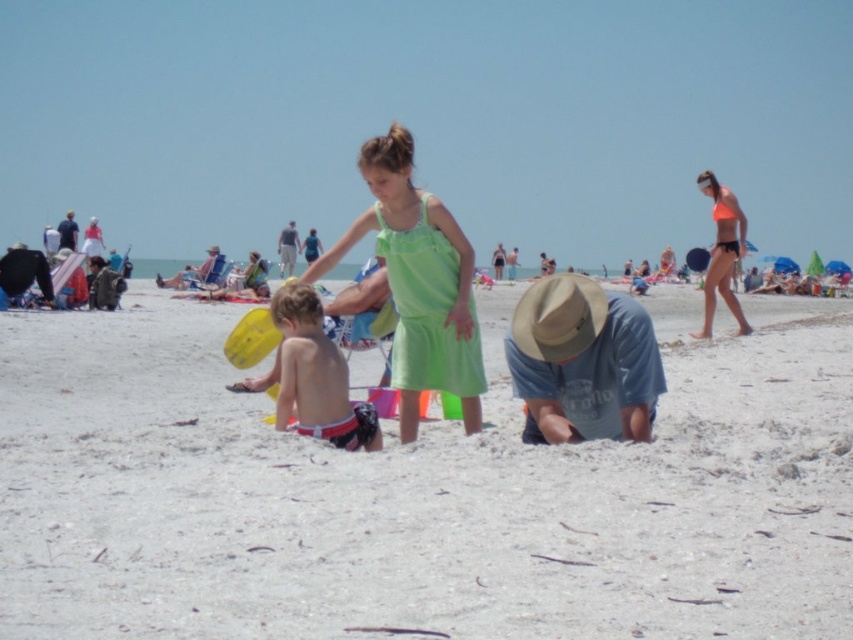
Is point (270, 518) positioned before point (726, 292)?

Yes, it is in front of point (726, 292).

Is white sandy beach at center wider than neon orange bikini at right?

Yes.

Is point (509, 516) positioned before point (741, 244)?

Yes, point (509, 516) is closer to viewer.

Locate an element on the screen. The height and width of the screenshot is (640, 853). white sandy beach at center is located at coordinates (421, 493).

Does white sandy beach at center appear under green cotton dress at center?

Yes.

What do you see at coordinates (421, 493) in the screenshot? The image size is (853, 640). I see `white sandy beach at center` at bounding box center [421, 493].

Find the location of a particular element. white sandy beach at center is located at coordinates (421, 493).

Locate an element on the screen. This screenshot has height=640, width=853. white sandy beach at center is located at coordinates (421, 493).

Is green cotton dress at center wider than denim blue shirt at center?

Yes.

Does green cotton dress at center have a smaller size compared to denim blue shirt at center?

No.

Is point (456, 252) positioned before point (579, 397)?

That is False.

Where is `green cotton dress at center`? The height and width of the screenshot is (640, 853). green cotton dress at center is located at coordinates (418, 282).